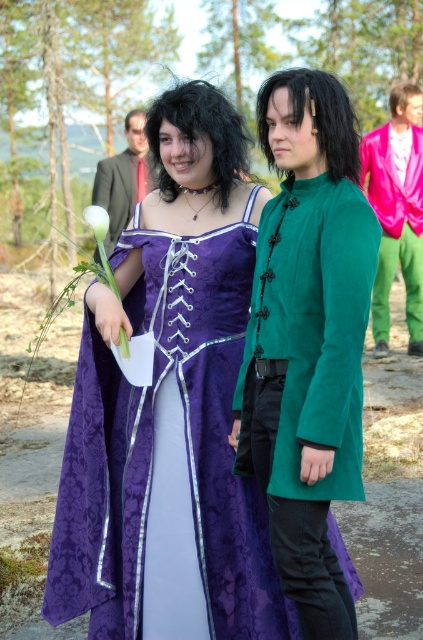
Question: Can you confirm if purple satin dress at center is positioned below matte green coat at center?

Choices:
 (A) no
 (B) yes

Answer: (B)

Question: Can you confirm if pink shiny jacket at upper right is positioned above matte green coat at center?

Choices:
 (A) yes
 (B) no

Answer: (B)

Question: Which object appears closest to the camera in this image?

Choices:
 (A) purple satin dress at center
 (B) matte green coat at center
 (C) green matte flower at center
 (D) pink shiny jacket at upper right

Answer: (C)

Question: Among these objects, which one is nearest to the camera?

Choices:
 (A) matte green coat at center
 (B) purple satin dress at center
 (C) green matte flower at center

Answer: (C)

Question: Which of the following is the farthest from the observer?

Choices:
 (A) (87, 216)
 (B) (277, 397)
 (C) (123, 204)
 (D) (401, 145)

Answer: (D)

Question: Is purple satin dress at center positioned at the back of green matte flower at center?

Choices:
 (A) yes
 (B) no

Answer: (A)